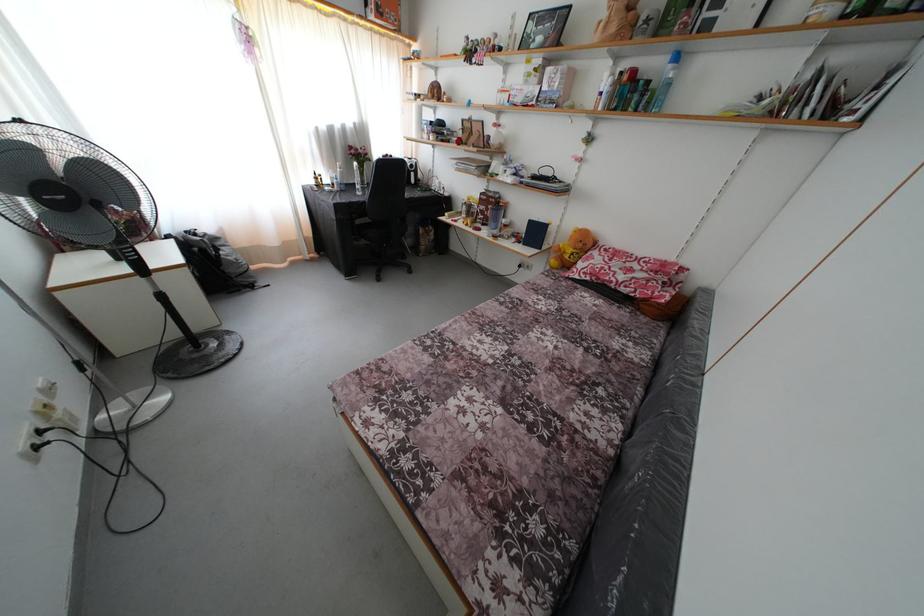
This screenshot has width=924, height=616. I want to click on grey sofa armrest, so click(655, 476).